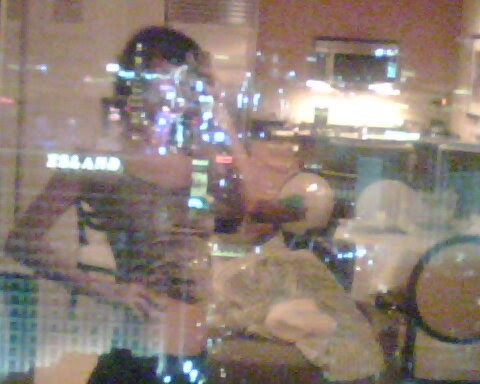
I want to click on silver counter tops, so click(x=464, y=144), click(x=349, y=137).